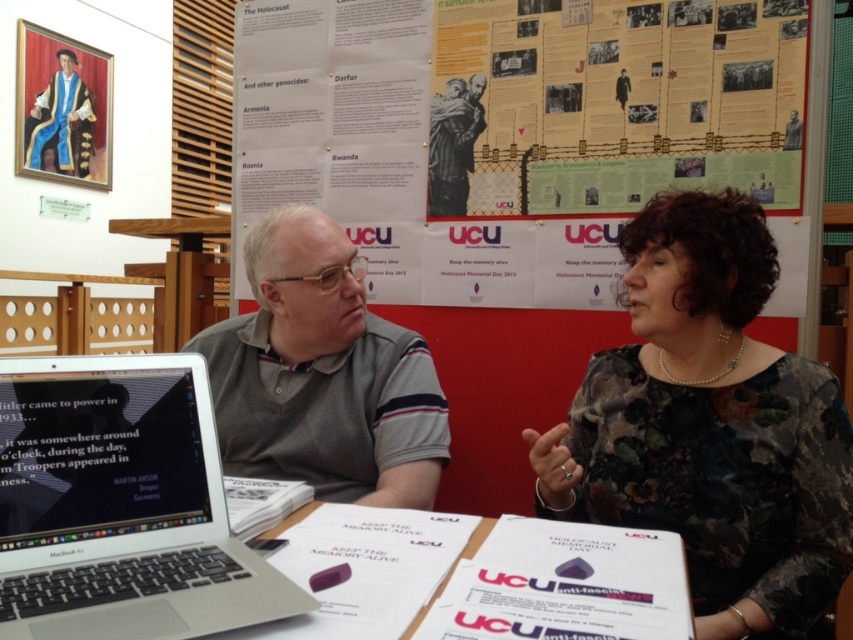
You are a student trying to read the white paper at center and the yellow paper poster at upper center on the table. Which one is closer to you?

The yellow paper poster at upper center is closer to you because the white paper at center is behind it.